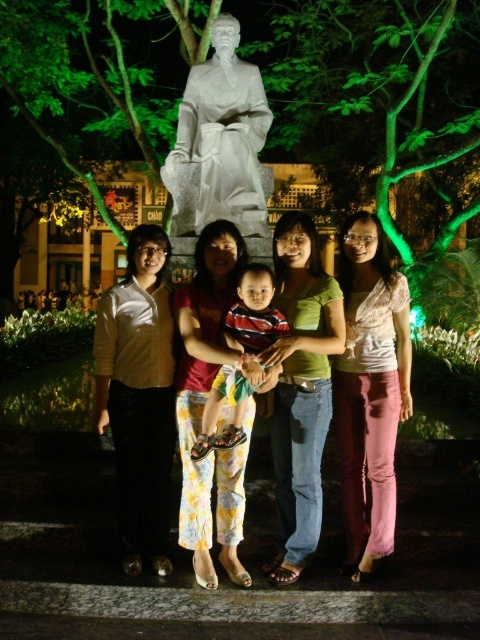
Between point (291, 349) and point (268, 115), which one is positioned behind?

Point (268, 115)

What do you see at coordinates (300, 387) in the screenshot?
I see `green cotton shirt at center` at bounding box center [300, 387].

At what (x,y) coordinates should I click in order to perform the action: click on green cotton shirt at center. Please return your answer as a coordinate pair (x, y). The height and width of the screenshot is (640, 480). Looking at the image, I should click on 300,387.

From the picture: Is matte white statue at center behind floral cotton pants at center?

Yes, matte white statue at center is behind floral cotton pants at center.

Does matte white statue at center have a greater width compared to floral cotton pants at center?

Yes, matte white statue at center is wider than floral cotton pants at center.

Describe the element at coordinates (303, 372) in the screenshot. The width and height of the screenshot is (480, 640). I see `matte white statue at center` at that location.

Image resolution: width=480 pixels, height=640 pixels. I want to click on matte white statue at center, so 303,372.

Does satin gold blouse at center have a larger size compared to striped cotton shirt at center?

Yes, satin gold blouse at center is bigger than striped cotton shirt at center.

Is the position of satin gold blouse at center less distant than that of striped cotton shirt at center?

Yes, it is.

What do you see at coordinates (139, 396) in the screenshot? I see `satin gold blouse at center` at bounding box center [139, 396].

I want to click on satin gold blouse at center, so click(139, 396).